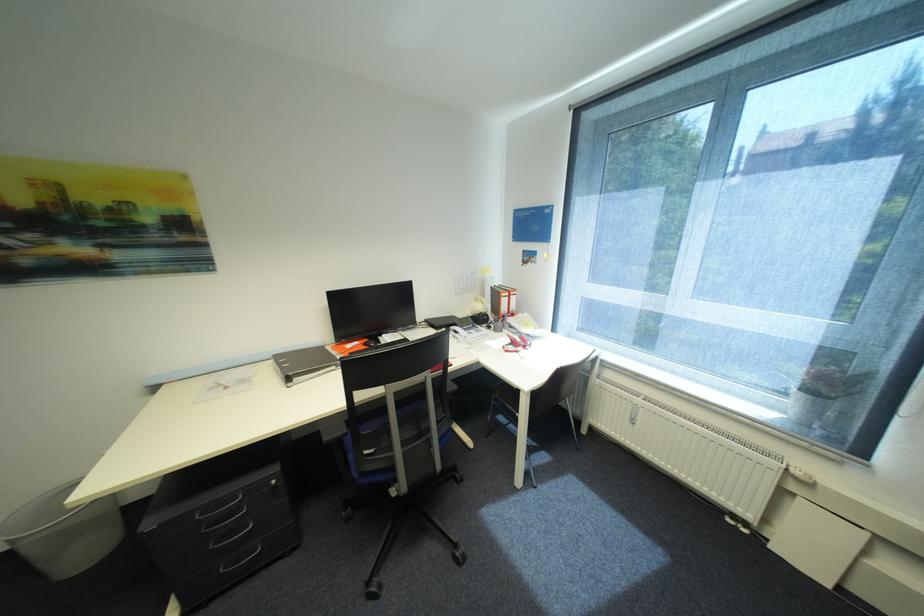
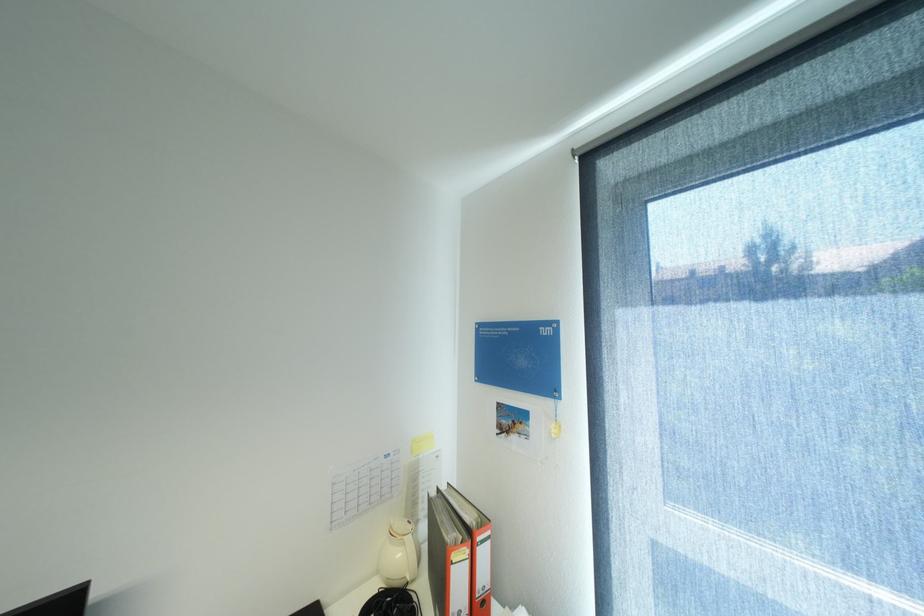
Locate, in the second image, the point that corresponds to [488,307] in the first image.

(407, 554)